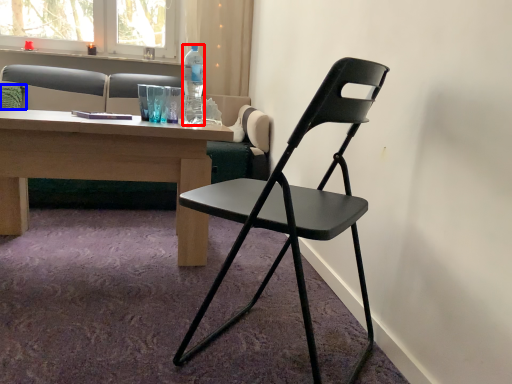
Question: Which of the following is the farthest to the observer, bottle (highlighted by a red box) or pillow (highlighted by a blue box)?

Choices:
 (A) bottle
 (B) pillow

Answer: (B)